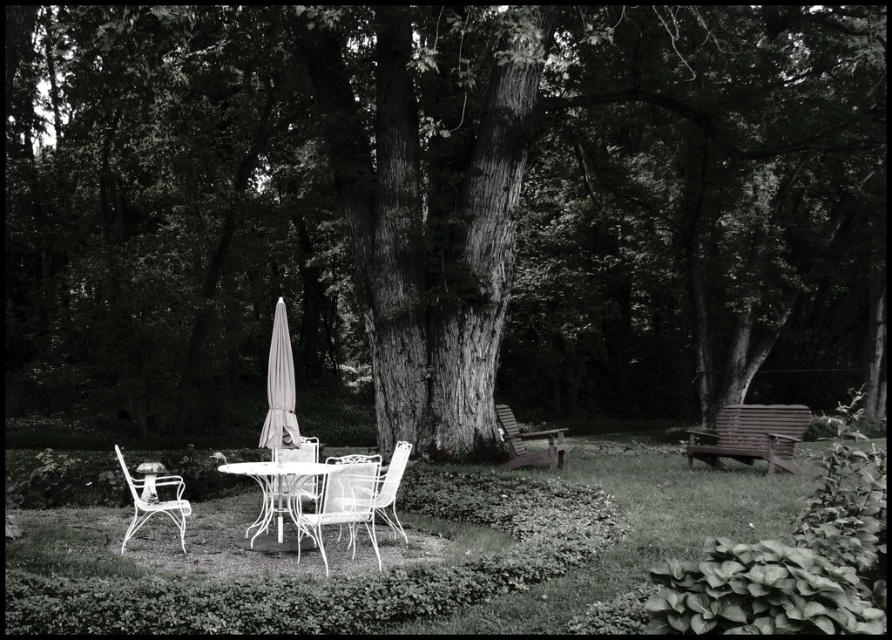
Based on the photo, you are standing in the garden and want to take a photo of both the point at coordinates point (369, 516) and point (266, 419). Which point will appear larger in your photo?

Point (369, 516) is closer to the camera than point (266, 419), so it will appear larger in the photo.

You are standing in the garden and want to place a small potted plant between the two points labeled point (753, 460) and point (295, 436). Which point should the plant be closer to so it is nearer to the viewer?

The plant should be placed closer to point (753, 460) because it is closer to the viewer compared to point (295, 436).

You are planning to place a new decorative item between the wooden bench at right and the light gray fabric umbrella at center. Which object should you place it closer to if you want the item to be near the narrower object?

You should place the decorative item closer to the wooden bench at right because it is thinner than the light gray fabric umbrella at center.